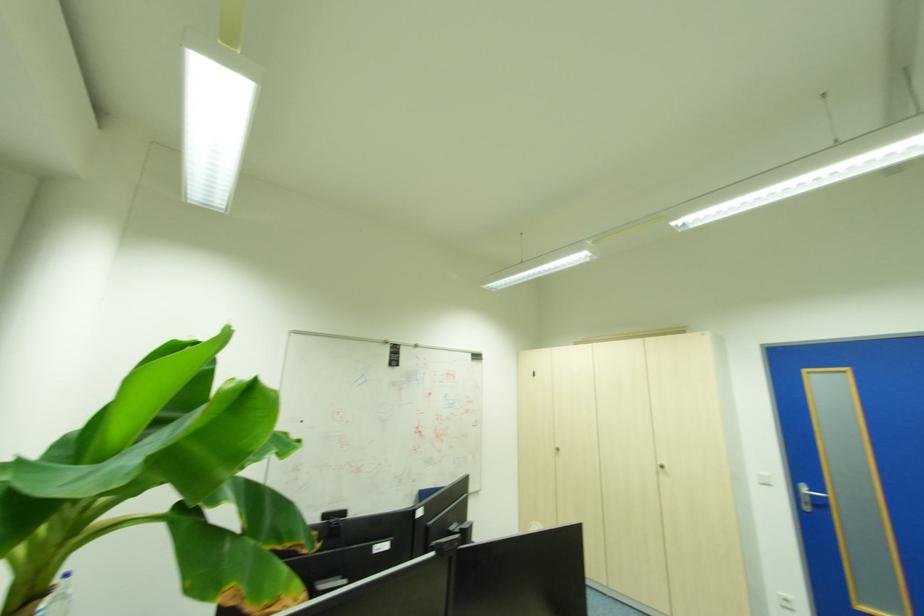
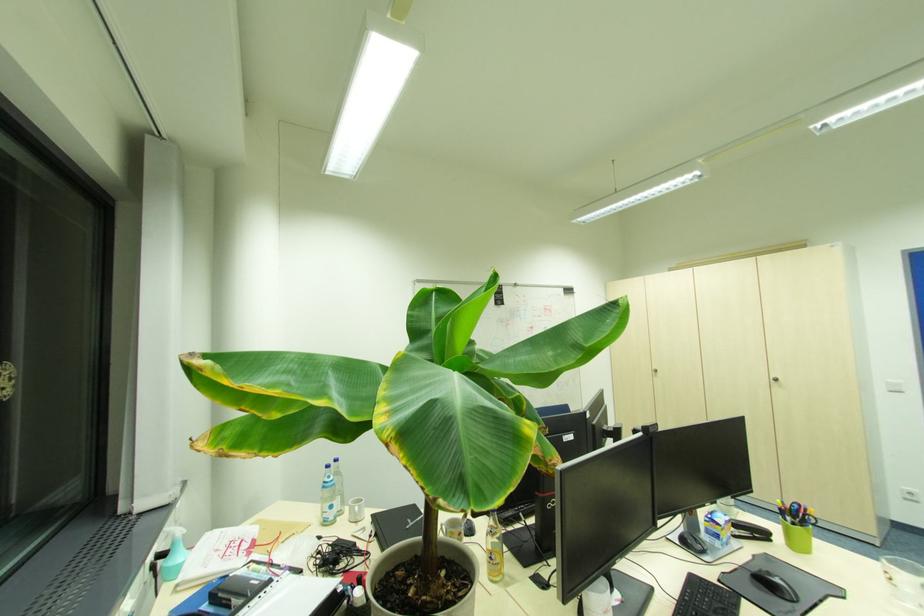
Consider the image. The images are taken continuously from a first-person perspective. In which direction are you moving?

The cameraman walked toward left, backward.